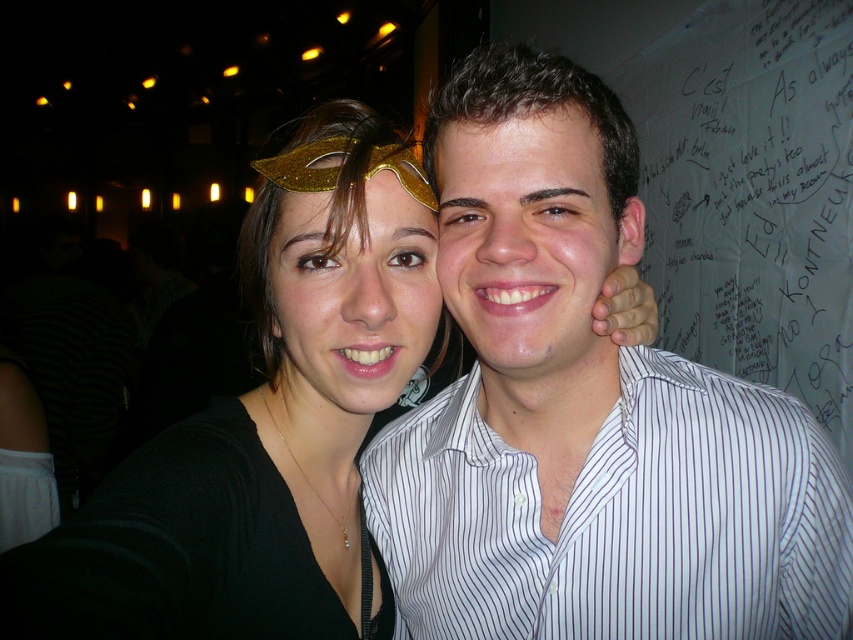
Is white striped shirt at right wider than matte gold mask at center?

Yes, white striped shirt at right is wider than matte gold mask at center.

Between white striped shirt at right and matte gold mask at center, which one appears on the left side from the viewer's perspective?

matte gold mask at center is more to the left.

The image size is (853, 640). Find the location of `white striped shirt at right`. white striped shirt at right is located at coordinates (619, 516).

Where is `white striped shirt at right`? This screenshot has width=853, height=640. white striped shirt at right is located at coordinates (619, 516).

Is point (454, 484) farther from viewer compared to point (576, 376)?

Yes, point (454, 484) is behind point (576, 376).

Based on the photo, can you confirm if white striped shirt at right is shorter than smooth white shirt at center?

No.

Where is `white striped shirt at right`? white striped shirt at right is located at coordinates (619, 516).

Who is positioned more to the left, matte black mask at upper left or white striped shirt at right?

matte black mask at upper left

Who is lower down, matte black mask at upper left or white striped shirt at right?

white striped shirt at right is below.

Describe the element at coordinates (260, 440) in the screenshot. I see `matte black mask at upper left` at that location.

This screenshot has height=640, width=853. In order to click on matte black mask at upper left in this screenshot , I will do `click(260, 440)`.